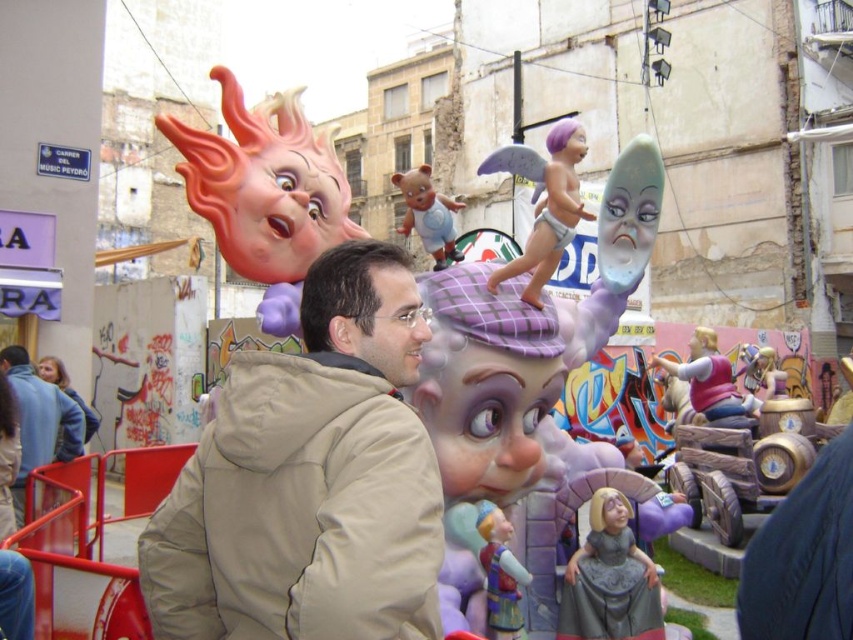
Question: Does matte plastic head at upper left have a smaller size compared to matte plastic bear at center?

Choices:
 (A) yes
 (B) no

Answer: (B)

Question: Which of the following is the closest to the observer?

Choices:
 (A) matte plastic bear at center
 (B) purple matte angel at center
 (C) matte plastic head at upper left
 (D) tan fabric jacket at center

Answer: (D)

Question: Is the position of tan fabric jacket at center more distant than that of purple matte angel at center?

Choices:
 (A) yes
 (B) no

Answer: (B)

Question: Is the position of matte plastic head at upper left more distant than that of wooden horse at center?

Choices:
 (A) yes
 (B) no

Answer: (B)

Question: Which of the following is the closest to the observer?

Choices:
 (A) matte plastic bear at center
 (B) matte plastic head at upper left
 (C) wooden horse at center
 (D) tan fabric jacket at center

Answer: (D)

Question: Which point is farther to the camera?

Choices:
 (A) beige fabric jacket at lower left
 (B) tan fabric jacket at center
 (C) purple matte angel at center

Answer: (A)